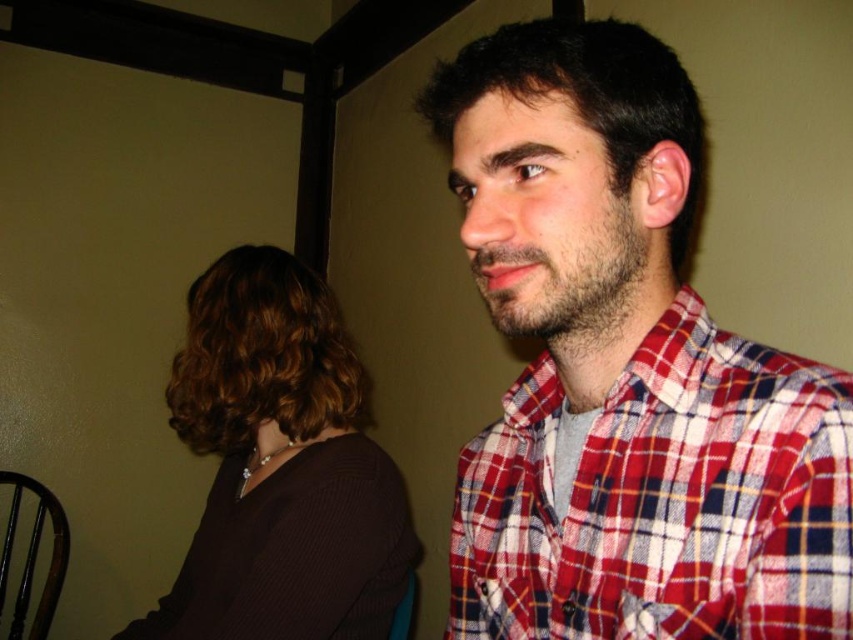
You are an interior designer assessing the layout of a room. You notice the plaid fabric shirt at center and the brown matte hair at upper left. Which object takes up more area in the image?

The brown matte hair at upper left takes up more area in the image than the plaid fabric shirt at center.

You are a photographer adjusting your camera settings to focus on the plaid fabric shirt at center and the brown matte hair at upper left. Which object should you focus on first to ensure both are in sharp focus?

The plaid fabric shirt at center is in front of the brown matte hair at upper left, so you should focus on the plaid fabric shirt at center first to ensure both are in sharp focus.